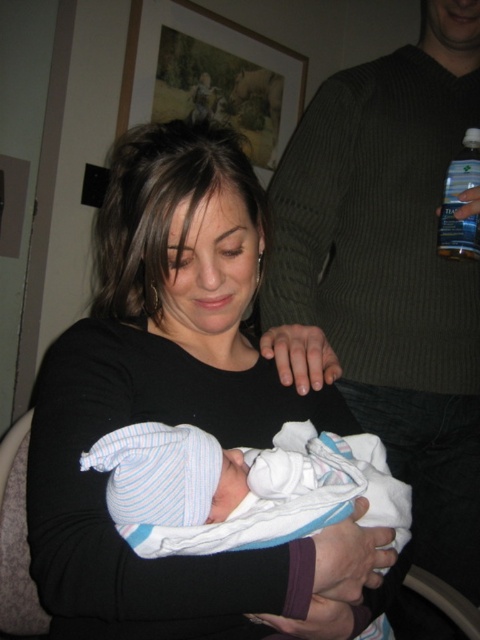
You are a photographer taking a photo of the black matte shirt at center and the striped knit hat at center. Which object will appear smaller in the photo?

The striped knit hat at center is behind the black matte shirt at center, so it will appear smaller in the photo due to being further away.

You are standing in the room and want to reach both the point at coordinates (457, 516) and the point at (244, 448). Which point is closer to you?

Point (244, 448) is closer to you because it is less further away than point (457, 516).